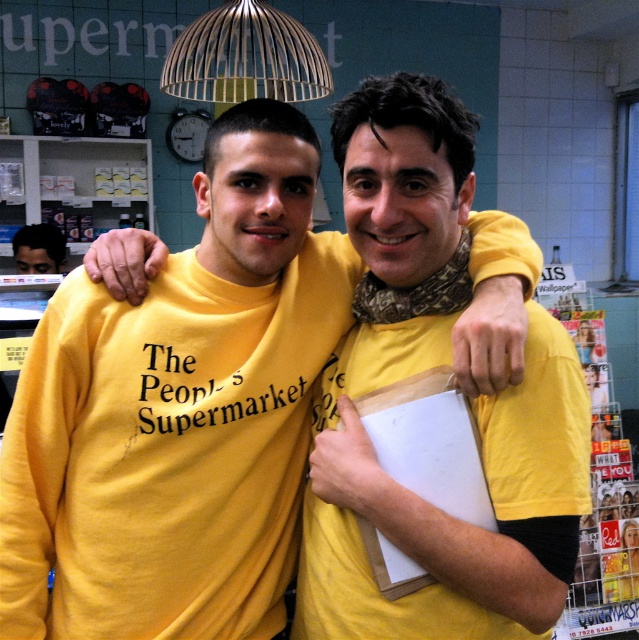
You are a photographer trying to capture a group photo of the yellow matte shirt at center and the matte black face at left. You need to ensure that both subjects are fully visible in the frame. Given their sizes, which subject might require you to adjust your camera angle to avoid cropping?

The yellow matte shirt at center has a larger width than the matte black face at left, so you may need to adjust the camera angle to accommodate its wider size to ensure it fits in the frame without cropping.